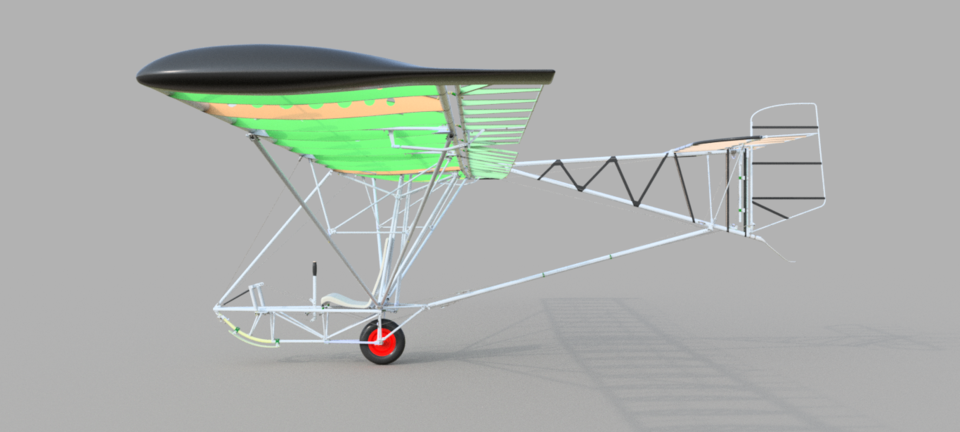
Image resolution: width=960 pixels, height=432 pixels. In order to click on seat back in this screenshot , I will do `click(386, 249)`.